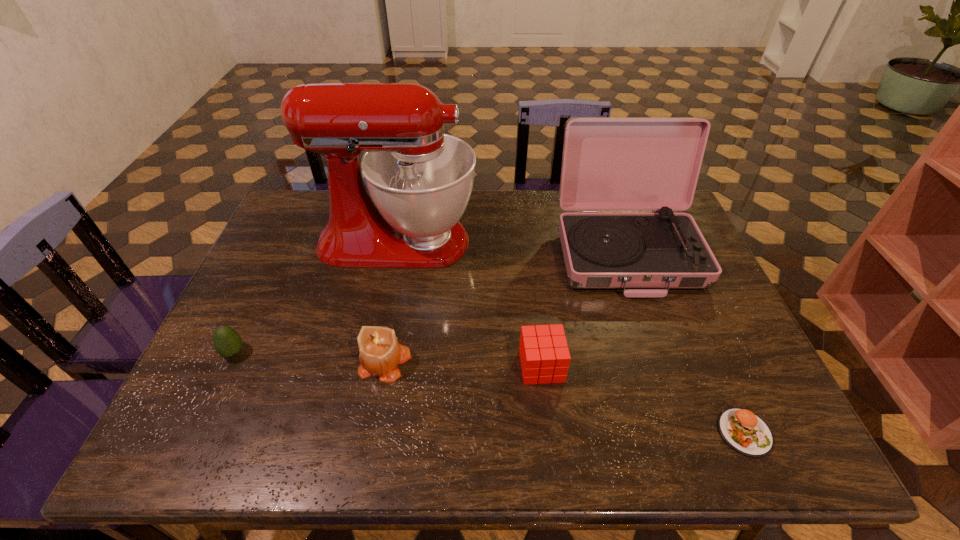
Where is `free space that satisfies the following two spatial constraints: 1. on the front side of the third tallest object; 2. on the left side of the patty`? free space that satisfies the following two spatial constraints: 1. on the front side of the third tallest object; 2. on the left side of the patty is located at coordinates (372, 433).

Where is `free region that satisfies the following two spatial constraints: 1. on the back side of the shortest object; 2. at the attachment hub of the tallest object`? free region that satisfies the following two spatial constraints: 1. on the back side of the shortest object; 2. at the attachment hub of the tallest object is located at coordinates (660, 241).

The height and width of the screenshot is (540, 960). Identify the location of free space that satisfies the following two spatial constraints: 1. on the back side of the cube; 2. at the attachment hub of the mixer. point(527,241).

The image size is (960, 540). Identify the location of free spot that satisfies the following two spatial constraints: 1. at the attachment hub of the mixer; 2. on the right side of the fourth object from left to right. (372, 366).